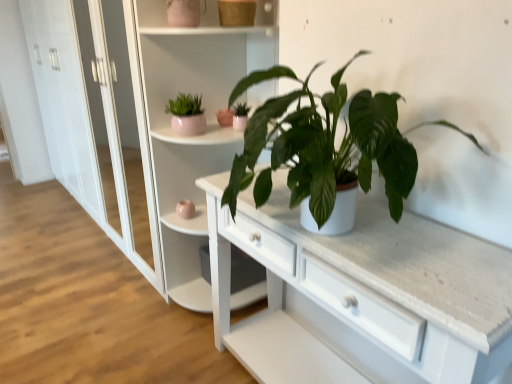
Measure the distance between point (154, 121) and camera.

1.99 meters.

This screenshot has width=512, height=384. Identify the location of matte white pot at center, marked as the second houseplant in a left-to-right arrangement. (240, 116).

Where is `houseplant that is the 2nd one when counting forward from the matte white pot at center, arranged as the second houseplant when viewed from the right`? This screenshot has height=384, width=512. houseplant that is the 2nd one when counting forward from the matte white pot at center, arranged as the second houseplant when viewed from the right is located at coordinates (326, 144).

Is green matte plant at center, which is the third houseplant in left-to-right order, taller or shorter than matte white pot at center, the third houseplant positioned from the front?

In the image, green matte plant at center, which is the third houseplant in left-to-right order, appears to be taller than matte white pot at center, the third houseplant positioned from the front.

Is green matte plant at center, which ranks as the third houseplant in back-to-front order, not within matte white pot at center, the 1th houseplant when ordered from back to front?

Yes, green matte plant at center, which ranks as the third houseplant in back-to-front order, is outside of matte white pot at center, the 1th houseplant when ordered from back to front.

Could you tell me if green matte plant at center, the 1th houseplant positioned from the front, is facing pink ceramic flowerpot at upper center?

No, green matte plant at center, the 1th houseplant positioned from the front, is not oriented towards pink ceramic flowerpot at upper center.

From the image's perspective, is green matte plant at center, which ranks as the third houseplant in back-to-front order, located above or below pink ceramic flowerpot at upper center?

green matte plant at center, which ranks as the third houseplant in back-to-front order, is situated lower than pink ceramic flowerpot at upper center in the image.

Looking at this image, does green matte plant at center, the 1th houseplant positioned from the front, come behind pink ceramic flowerpot at upper center?

No, it is in front of pink ceramic flowerpot at upper center.

Is white glossy bookshelf at upper center positioned before green matte plant at center, the 1th houseplant positioned from the front?

No, white glossy bookshelf at upper center is further to the viewer.

From a real-world perspective, which object rests below the other?

white glossy bookshelf at upper center is physically lower.

Looking at the image, does white glossy bookshelf at upper center seem bigger or smaller compared to green matte plant at center, which is the third houseplant in left-to-right order?

Considering their sizes, white glossy bookshelf at upper center takes up more space than green matte plant at center, which is the third houseplant in left-to-right order.

Which is behind, point (236, 65) or point (388, 197)?

The point (236, 65) is more distant.

Considering the relative sizes of matte white pot at center, arranged as the second houseplant when viewed from the right, and green matte plant at center, marked as the first houseplant in a right-to-left arrangement, in the image provided, is matte white pot at center, arranged as the second houseplant when viewed from the right, thinner than green matte plant at center, marked as the first houseplant in a right-to-left arrangement,?

Yes.

Based on the photo, does matte white pot at center, marked as the second houseplant in a left-to-right arrangement, appear on the left side of green matte plant at center, marked as the first houseplant in a right-to-left arrangement?

Indeed, matte white pot at center, marked as the second houseplant in a left-to-right arrangement, is positioned on the left side of green matte plant at center, marked as the first houseplant in a right-to-left arrangement.

Consider the image. From a real-world perspective, is matte white pot at center, the third houseplant positioned from the front, positioned above or below green matte plant at center, which is the third houseplant in left-to-right order?

In terms of real-world spatial position, matte white pot at center, the third houseplant positioned from the front, is below green matte plant at center, which is the third houseplant in left-to-right order.

Would you say matte white pot at center, the third houseplant positioned from the front, is inside or outside green matte plant at center, which ranks as the third houseplant in back-to-front order?

The correct answer is: outside.

From their relative heights in the image, would you say matte pink pot at upper left, which is the 1th houseplant from left to right, is taller or shorter than green matte plant at center, which is the third houseplant in left-to-right order?

Clearly, matte pink pot at upper left, which is the 1th houseplant from left to right, is shorter compared to green matte plant at center, which is the third houseplant in left-to-right order.

Which is behind, point (204, 129) or point (255, 122)?

The point (204, 129) is behind.

From a real-world perspective, which is physically above, matte pink pot at upper left, which is the 1th houseplant from left to right, or green matte plant at center, the 1th houseplant positioned from the front?

green matte plant at center, the 1th houseplant positioned from the front.

Between pink ceramic flowerpot at upper center and green matte plant at center, marked as the first houseplant in a right-to-left arrangement, which one has less height?

With less height is pink ceramic flowerpot at upper center.

Which is closer to the camera, (230, 123) or (305, 159)?

Positioned in front is point (305, 159).

How much distance is there between pink ceramic flowerpot at upper center and green matte plant at center, marked as the first houseplant in a right-to-left arrangement?

pink ceramic flowerpot at upper center and green matte plant at center, marked as the first houseplant in a right-to-left arrangement, are 36.59 inches apart from each other.

Is green matte plant at center, marked as the first houseplant in a right-to-left arrangement, positioned behind white glossy bookshelf at upper center?

That is False.

Is green matte plant at center, which ranks as the third houseplant in back-to-front order, outside of white glossy bookshelf at upper center?

Yes, green matte plant at center, which ranks as the third houseplant in back-to-front order, is not within white glossy bookshelf at upper center.

Considering the sizes of green matte plant at center, the 1th houseplant positioned from the front, and white glossy bookshelf at upper center in the image, is green matte plant at center, the 1th houseplant positioned from the front, bigger or smaller than white glossy bookshelf at upper center?

green matte plant at center, the 1th houseplant positioned from the front, is smaller than white glossy bookshelf at upper center.

Locate an element on the screen. The width and height of the screenshot is (512, 384). the 1st houseplant counting from the left side of the green matte plant at center, the 1th houseplant positioned from the front is located at coordinates (240, 116).

Find the location of `the 3rd houseplant in front of the pink ceramic flowerpot at upper center`. the 3rd houseplant in front of the pink ceramic flowerpot at upper center is located at coordinates (326, 144).

Looking at the image, which one is located further to pink ceramic flowerpot at upper center, matte white pot at center, the third houseplant positioned from the front, or matte pink pot at upper left, the 2th houseplant positioned from the back?

The object further to pink ceramic flowerpot at upper center is matte pink pot at upper left, the 2th houseplant positioned from the back.

When comparing their distances from green matte plant at center, the 1th houseplant positioned from the front, does white glossy bookshelf at upper center or matte pink pot at upper left, which is the 1th houseplant from left to right, seem further?

matte pink pot at upper left, which is the 1th houseplant from left to right, is further to green matte plant at center, the 1th houseplant positioned from the front.

From the image, which object appears to be nearer to white glossy bookshelf at upper center, matte white pot at center, the third houseplant positioned from the front, or pink ceramic flowerpot at upper center?

pink ceramic flowerpot at upper center is positioned closer to the anchor white glossy bookshelf at upper center.

Which object lies nearer to the anchor point matte white pot at center, arranged as the second houseplant when viewed from the right, pink ceramic flowerpot at upper center or white glossy bookshelf at upper center?

Based on the image, pink ceramic flowerpot at upper center appears to be nearer to matte white pot at center, arranged as the second houseplant when viewed from the right.

From the image, which object appears to be farther from green matte plant at center, which is the third houseplant in left-to-right order, matte white pot at center, the 1th houseplant when ordered from back to front, or matte pink pot at upper left, the 2th houseplant positioned from the back?

matte pink pot at upper left, the 2th houseplant positioned from the back.

Estimate the real-world distances between objects in this image. Which object is further from matte pink pot at upper left, which ranks as the 2th houseplant in front-to-back order, white glossy bookshelf at upper center or green matte plant at center, the 1th houseplant positioned from the front?

green matte plant at center, the 1th houseplant positioned from the front.

Considering their positions, is matte white pot at center, arranged as the second houseplant when viewed from the right, positioned further to matte pink pot at upper left, which is the 1th houseplant from left to right, than white glossy bookshelf at upper center?

white glossy bookshelf at upper center lies further to matte pink pot at upper left, which is the 1th houseplant from left to right, than the other object.

Which object lies further to the anchor point white glossy bookshelf at upper center, green matte plant at center, which ranks as the third houseplant in back-to-front order, or matte pink pot at upper left, the third houseplant viewed from the right?

green matte plant at center, which ranks as the third houseplant in back-to-front order.

At what (x,y) coordinates should I click in order to perform the action: click on bookshelf between green matte plant at center, the 1th houseplant positioned from the front, and matte pink pot at upper left, which is the 1th houseplant from left to right, in the front-back direction. Please return your answer as a coordinate pair (x, y). Looking at the image, I should click on (189, 137).

Locate an element on the screen. The image size is (512, 384). bookshelf between green matte plant at center, which ranks as the third houseplant in back-to-front order, and matte white pot at center, the 1th houseplant when ordered from back to front, from front to back is located at coordinates (189, 137).

Where is `houseplant between green matte plant at center, which ranks as the third houseplant in back-to-front order, and matte white pot at center, arranged as the second houseplant when viewed from the right, from front to back`? houseplant between green matte plant at center, which ranks as the third houseplant in back-to-front order, and matte white pot at center, arranged as the second houseplant when viewed from the right, from front to back is located at coordinates (187, 115).

Locate an element on the screen. The width and height of the screenshot is (512, 384). flowerpot between matte pink pot at upper left, the third houseplant viewed from the right, and matte white pot at center, the third houseplant positioned from the front, from left to right is located at coordinates (225, 117).